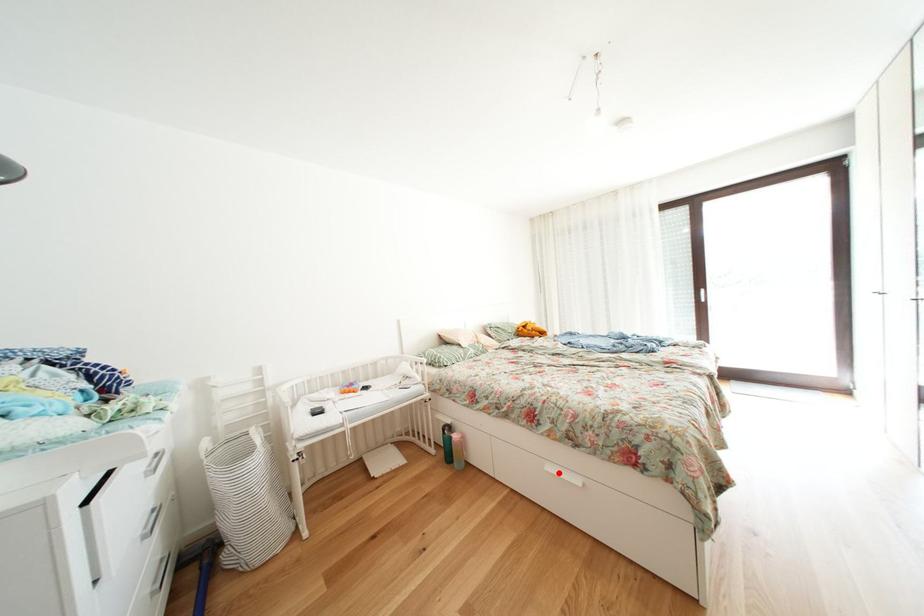
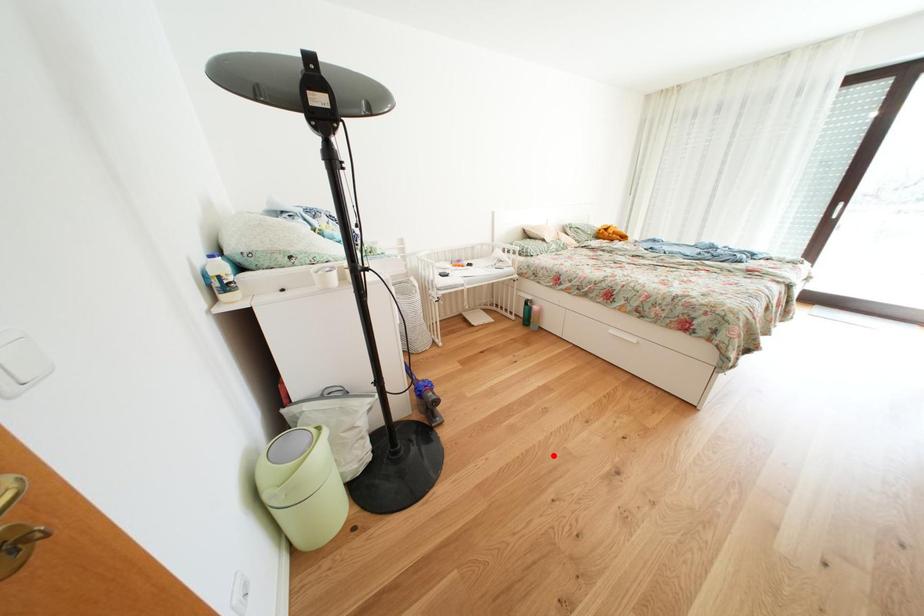
Looking at this image, I am providing you with two images of the same scene from different viewpoints. A red point is marked on the first image and another point is marked on the second image. Is the red point in image1 aligned with the point shown in image2?

No